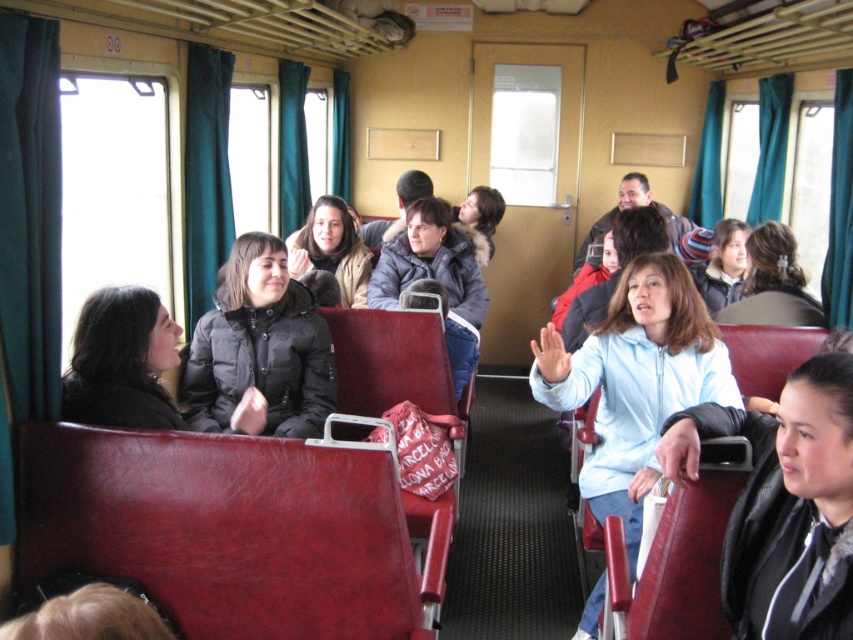
The height and width of the screenshot is (640, 853). What do you see at coordinates (784, 504) in the screenshot?
I see `black leather jacket at center` at bounding box center [784, 504].

Is point (715, 417) positioned behind point (202, 316)?

No, it is in front of (202, 316).

Between point (821, 608) and point (310, 365), which one is positioned in front?

Point (821, 608) is more forward.

You are a GUI agent. You are given a task and a screenshot of the screen. Output one action in this format:
    pyautogui.click(x=<x>, y=<y>)
    Task: Click on the black leather jacket at center
    
    Given the screenshot: What is the action you would take?
    pyautogui.click(x=784, y=504)